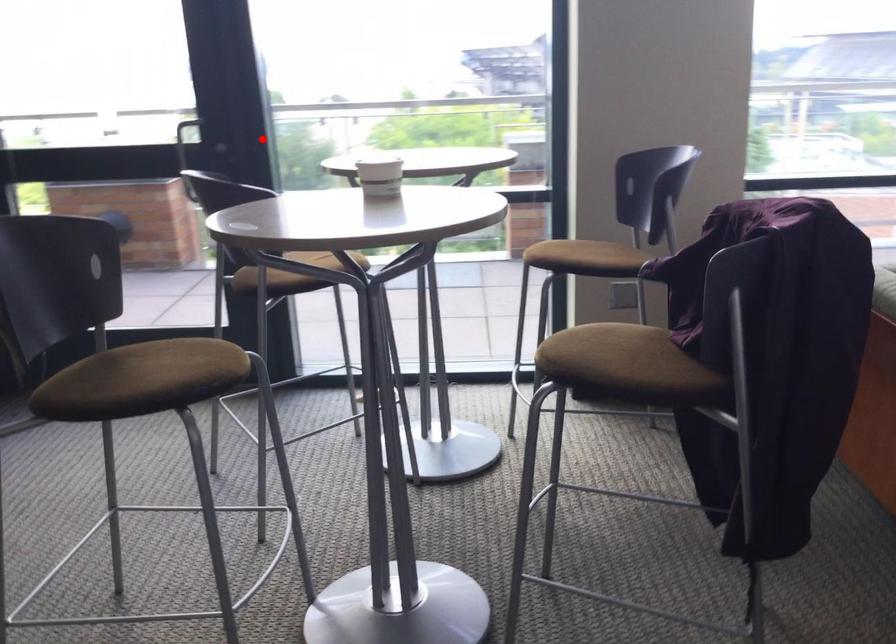
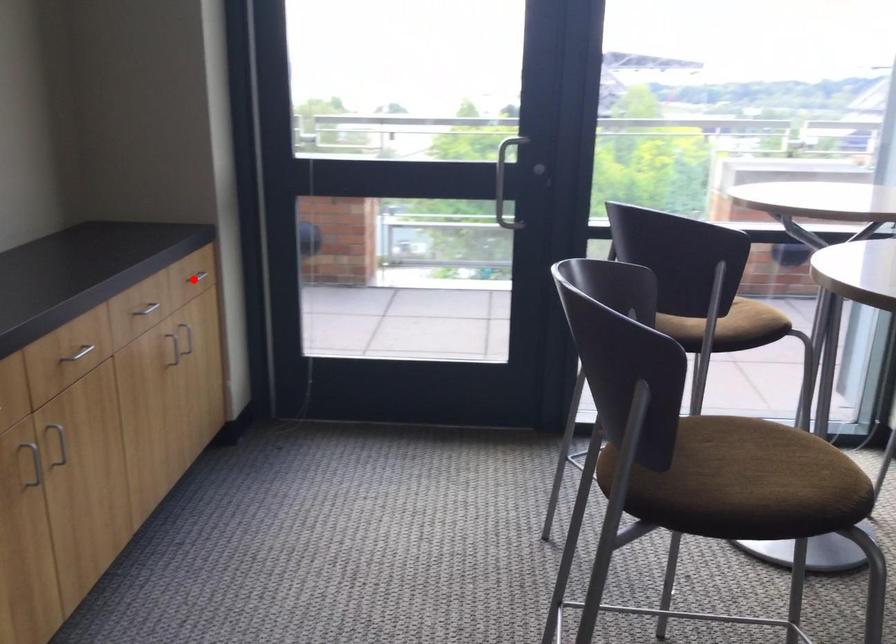
I am providing you with two images of the same scene from different viewpoints. A red point is marked on the first image and another point is marked on the second image. Does the point marked in image1 correspond to the same location as the one in image2?

No